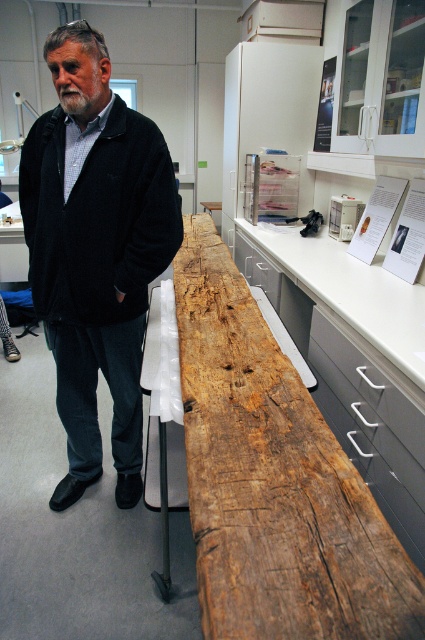
Question: Does weathered wood beam at center have a larger size compared to black woolen sweater at center?

Choices:
 (A) no
 (B) yes

Answer: (A)

Question: Which point is farther to the camera?

Choices:
 (A) white smooth countertop at center
 (B) black woolen sweater at center

Answer: (B)

Question: Which object appears farthest from the camera in this image?

Choices:
 (A) black woolen sweater at center
 (B) weathered wood beam at center

Answer: (A)

Question: Can you confirm if weathered wood beam at center is smaller than white smooth countertop at center?

Choices:
 (A) no
 (B) yes

Answer: (B)

Question: From the image, what is the correct spatial relationship of weathered wood beam at center in relation to white smooth countertop at center?

Choices:
 (A) below
 (B) above

Answer: (A)

Question: Which point is closer to the camera?

Choices:
 (A) (105, 180)
 (B) (241, 637)
 (C) (337, 284)

Answer: (B)